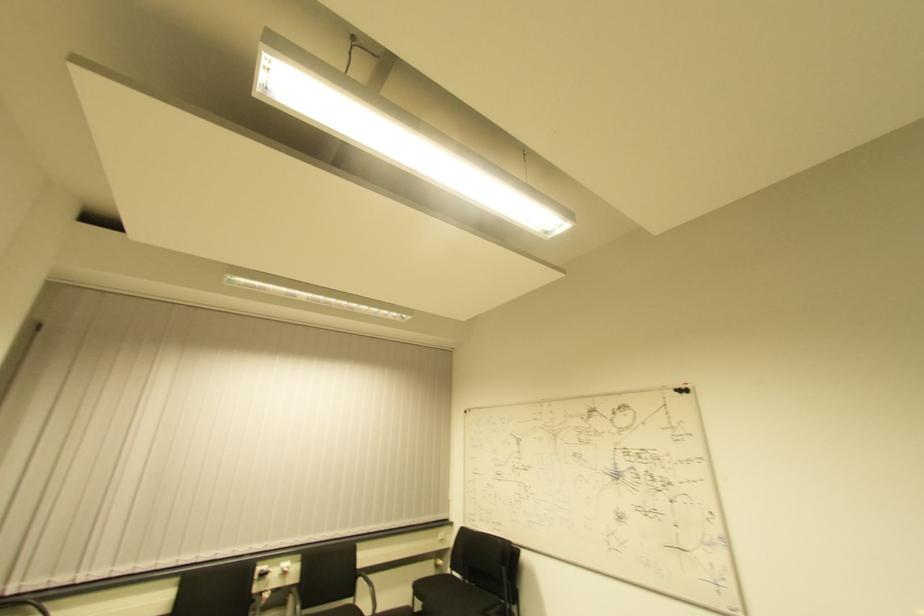
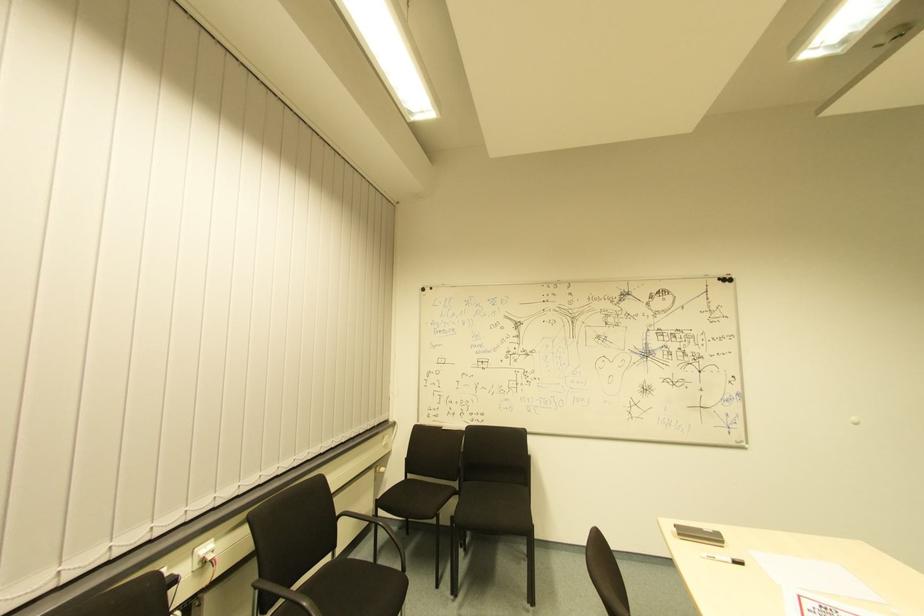
The point at (x=454, y=576) is marked in the first image. Where is the corresponding point in the second image?

(408, 479)